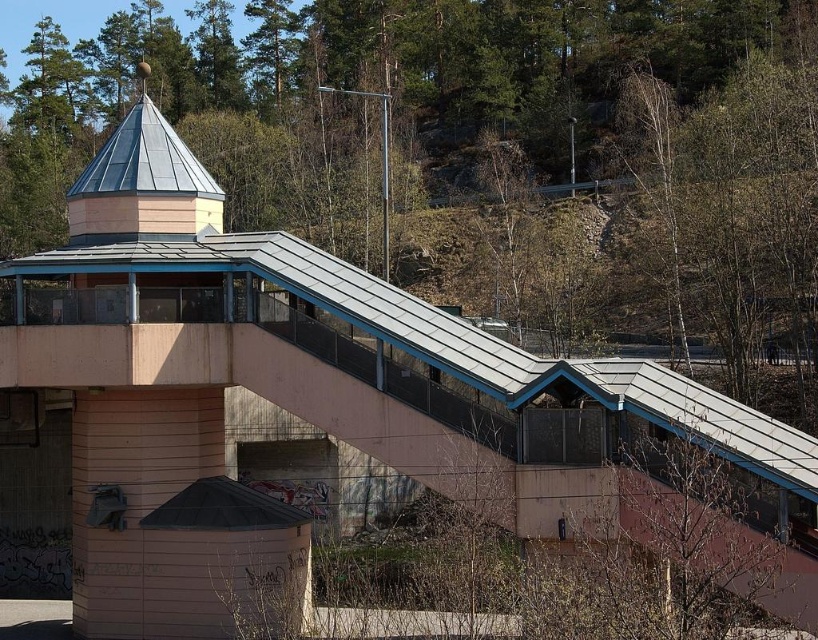
Question: Does green leafy tree at center come in front of metallic silver spire at upper center?

Choices:
 (A) yes
 (B) no

Answer: (B)

Question: Can you confirm if green leafy tree at center is bigger than metallic silver spire at upper center?

Choices:
 (A) no
 (B) yes

Answer: (B)

Question: Can you confirm if green leafy tree at center is smaller than metallic silver spire at upper center?

Choices:
 (A) yes
 (B) no

Answer: (B)

Question: Which of the following is the closest to the observer?

Choices:
 (A) tap(730, 369)
 (B) tap(187, 227)

Answer: (B)